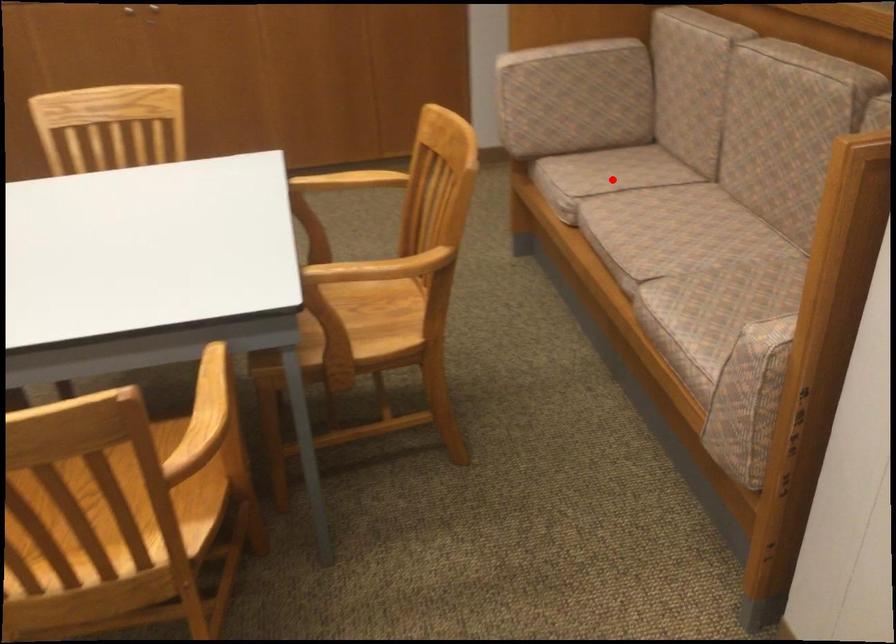
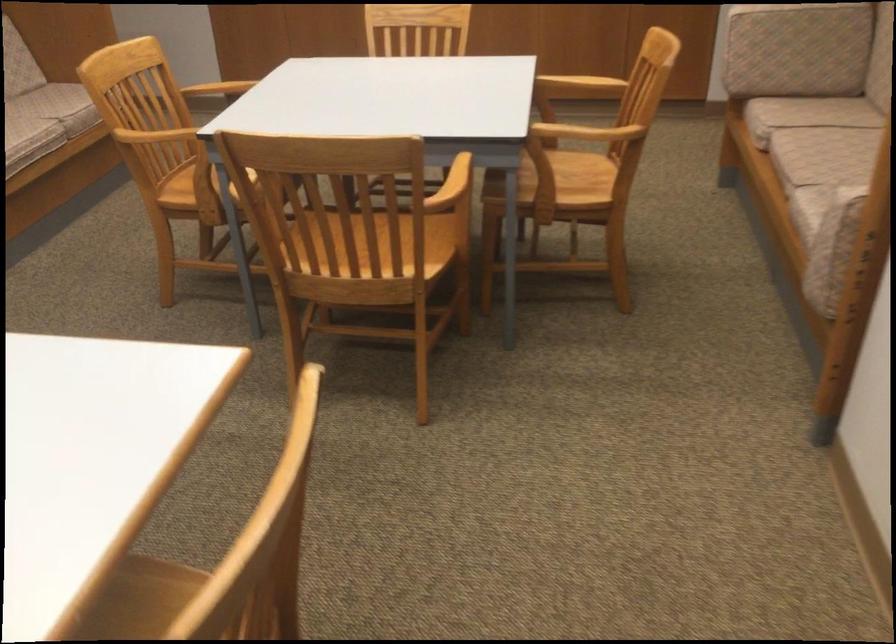
Question: I am providing you with two images of the same scene from different viewpoints. Given a red point in image1, look at the same physical point in image2. Is it:

Choices:
 (A) Closer to the viewpoint
 (B) Farther from the viewpoint

Answer: (B)